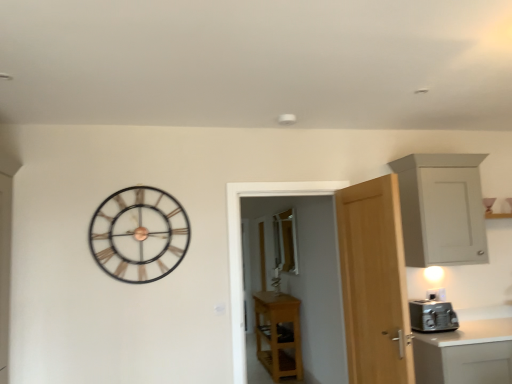
Question: From a real-world perspective, is metallic silver toaster at right above or below metallic gold clock at upper left?

Choices:
 (A) above
 (B) below

Answer: (B)

Question: Is point (457, 321) closer or farther from the camera than point (141, 210)?

Choices:
 (A) closer
 (B) farther

Answer: (B)

Question: Which is farther from the clear glass window at center?

Choices:
 (A) white matte cabinet at upper right, the 2th cabinetry from the left
 (B) metallic silver toaster at right
 (C) light wood door at right
 (D) metallic gold clock at upper left
 (E) light wood cabinet at center, arranged as the first cabinetry when ordered from the bottom

Answer: (D)

Question: Estimate the real-world distances between objects in this image. Which object is farther from the light wood door at right?

Choices:
 (A) metallic silver toaster at right
 (B) light wood cabinet at center, which is the first cabinetry in left-to-right order
 (C) white matte cabinet at upper right, the 2th cabinetry from the left
 (D) clear glass window at center
 (E) metallic gold clock at upper left

Answer: (B)